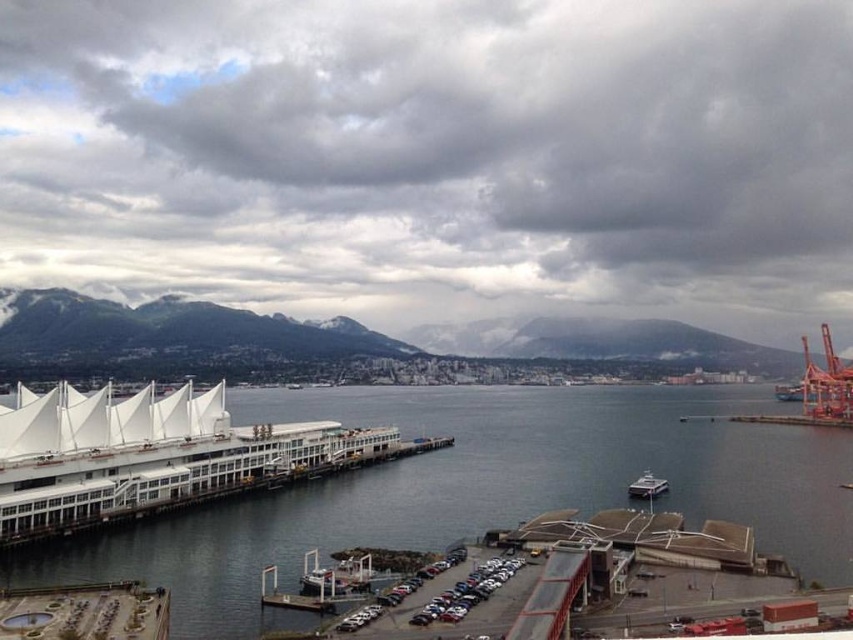
You are a photographer planning to take a photo of the waterfront scene. You want to ensure that both the transparent glass water at center and the white glossy boat at center are clearly visible in your shot. Based on their relative heights, which object will appear larger in the photograph?

The transparent glass water at center will appear larger in the photograph because it has a greater height compared to the white glossy boat at center.

You are standing at the point with coordinates point (653,488) and want to walk to the point with coordinates point (393,392). Which direction should you move relative to the other point?

You should move towards the point (393,392), which is behind point (653,488), so you need to walk in the direction away from the waterfront towards the parking lot area.

You are standing on the dock and looking at the transparent glass water at center and the white glossy boat at center. Which object is positioned higher relative to the other?

The white glossy boat at center is positioned higher than the transparent glass water at center because the water is located below the boat.